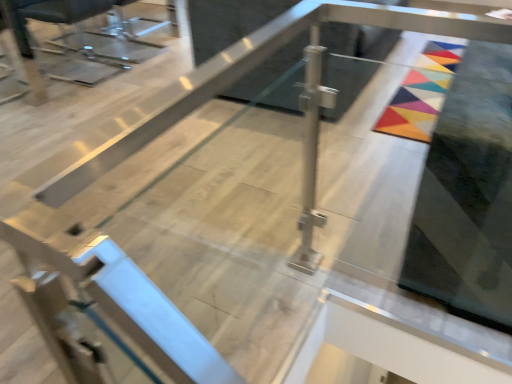
In order to face metallic gray swivel chair at upper left, should I rotate leftwards or rightwards?

Rotate your view left by about 22.082°.

From the picture: Measure the distance between metallic gray swivel chair at upper left and camera.

metallic gray swivel chair at upper left is 2.83 meters away from camera.

Find the location of a particular element. This screenshot has width=512, height=384. metallic gray swivel chair at upper left is located at coordinates (77, 40).

The height and width of the screenshot is (384, 512). What do you see at coordinates (77, 40) in the screenshot?
I see `metallic gray swivel chair at upper left` at bounding box center [77, 40].

Identify the location of metallic gray swivel chair at upper left. (77, 40).